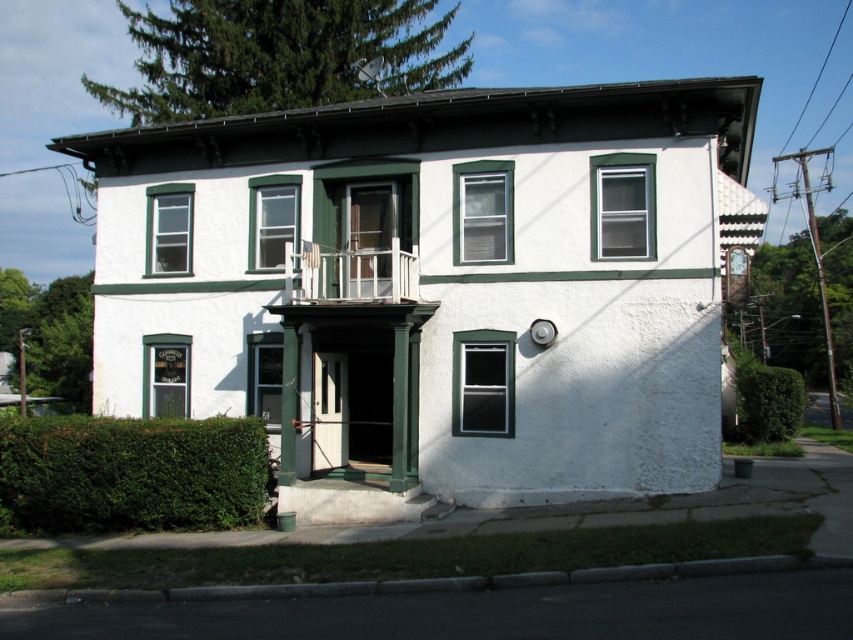
Which of these two, green painted wood trim at center or green leafy hedge at lower left, stands shorter?

green leafy hedge at lower left

At what (x,y) coordinates should I click in order to perform the action: click on green painted wood trim at center. Please return your answer as a coordinate pair (x, y). Looking at the image, I should click on (433, 288).

You are a GUI agent. You are given a task and a screenshot of the screen. Output one action in this format:
    pyautogui.click(x=<x>, y=<y>)
    Task: Click on the green painted wood trim at center
    
    Given the screenshot: What is the action you would take?
    pyautogui.click(x=433, y=288)